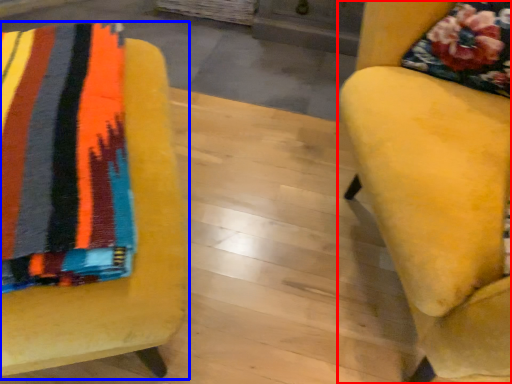
Question: Which point is closer to the camera, chair (highlighted by a red box) or chair (highlighted by a blue box)?

Choices:
 (A) chair
 (B) chair

Answer: (A)